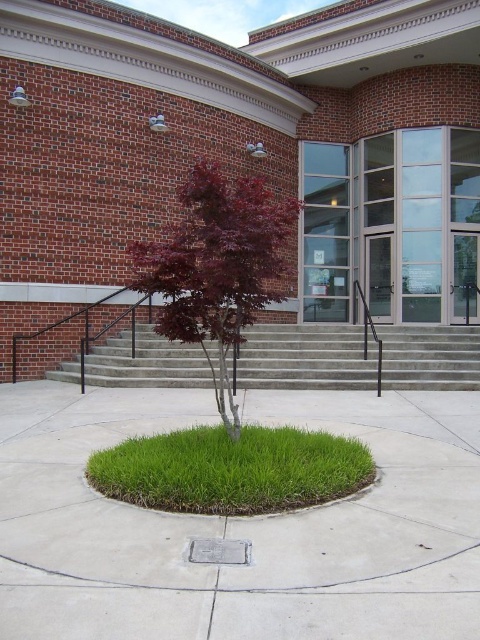
You are standing at the entrance of the brick building and want to place a small potted plant exactly at the point marked as point [240,524]. According to the scene description, where should you place the potted plant?

The point [240,524] is located on the green concrete at center, so you should place the potted plant on the green concrete at center.

You are a maintenance worker needing to reach the green concrete at center from the entrance. The path is 4.60 meters long. If your ladder is 4.5 meters long, will it be sufficient to cross the distance?

The distance between the entrance and the green concrete at center is 4.60 meters. Since the ladder is only 4.5 meters long, it is 10 centimeters shorter than needed. Therefore, the ladder will not be sufficient to cross the distance.

You are a gardener planning to plant flowers in the entrance area. You have two spots available at the center area. The first spot is on the green concrete at center and the second is on the green grass at center. Which location has more space for planting flowers?

The green grass at center has a greater width than the green concrete at center, so it offers more space for planting flowers.